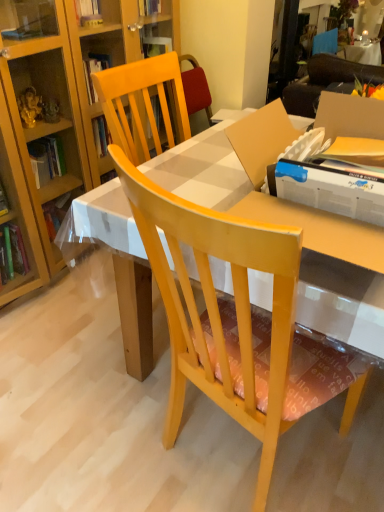
Find the location of a particular element. This screenshot has height=512, width=384. brown fabric couch at upper right is located at coordinates click(x=326, y=81).

The height and width of the screenshot is (512, 384). What are the coordinates of `light wood chair at center` in the screenshot? It's located at (221, 310).

Which of these two, brown fabric couch at upper right or light wood chair at center, is thinner?

With smaller width is brown fabric couch at upper right.

Measure the distance between brown fabric couch at upper right and light wood chair at center.

brown fabric couch at upper right and light wood chair at center are 5.60 feet apart from each other.

I want to click on chair on the left of brown fabric couch at upper right, so click(x=221, y=310).

Which object is positioned more to the left, green leafy plant at upper right or light wood chair at center?

From the viewer's perspective, light wood chair at center appears more on the left side.

Which point is more distant from viewer, (345, 6) or (179, 377)?

Positioned behind is point (345, 6).

From the picture: Considering the sizes of objects green leafy plant at upper right and light wood chair at center in the image provided, who is smaller, green leafy plant at upper right or light wood chair at center?

With smaller size is green leafy plant at upper right.

From the picture: Considering the relative sizes of green leafy plant at upper right and light wood chair at center in the image provided, is green leafy plant at upper right thinner than light wood chair at center?

Yes, green leafy plant at upper right is thinner than light wood chair at center.

From a real-world perspective, is brown fabric couch at upper right positioned under green leafy plant at upper right based on gravity?

Actually, brown fabric couch at upper right is physically above green leafy plant at upper right in the real world.

Between brown fabric couch at upper right and green leafy plant at upper right, which one has larger width?

Wider between the two is green leafy plant at upper right.

Between point (321, 79) and point (342, 38), which one is positioned behind?

The point (342, 38) is farther from the camera.

Is brown fabric couch at upper right oriented towards green leafy plant at upper right?

Yes, brown fabric couch at upper right is oriented towards green leafy plant at upper right.

Based on the photo, could you tell me if green leafy plant at upper right is facing brown fabric couch at upper right?

No, green leafy plant at upper right does not turn towards brown fabric couch at upper right.

Which object is further away from the camera taking this photo, green leafy plant at upper right or brown fabric couch at upper right?

green leafy plant at upper right is further from the camera.

Does green leafy plant at upper right have a smaller size compared to brown fabric couch at upper right?

Actually, green leafy plant at upper right might be larger than brown fabric couch at upper right.

From the image's perspective, between green leafy plant at upper right and brown fabric couch at upper right, which one is located above?

green leafy plant at upper right, from the image's perspective.

Looking at this image, considering the sizes of objects light wood chair at center and green leafy plant at upper right in the image provided, who is wider, light wood chair at center or green leafy plant at upper right?

light wood chair at center.

Which is in front, light wood chair at center or green leafy plant at upper right?

light wood chair at center is closer to the camera.

Consider the image. Is green leafy plant at upper right at the back of light wood chair at center?

Yes, light wood chair at center is facing away from green leafy plant at upper right.

Considering the positions of points (289, 360) and (329, 15), is point (289, 360) closer to camera compared to point (329, 15)?

Yes, point (289, 360) is in front of point (329, 15).

How far apart are light wood chair at center and brown fabric couch at upper right?

They are 5.60 feet apart.

Which object is further away from the camera, light wood chair at center or brown fabric couch at upper right?

brown fabric couch at upper right is further away from the camera.

Based on the photo, who is bigger, light wood chair at center or brown fabric couch at upper right?

With larger size is light wood chair at center.

Locate an element on the screen. This screenshot has height=512, width=384. studio couch located above the light wood chair at center (from the image's perspective) is located at coordinates (326, 81).

The image size is (384, 512). In order to click on chair in front of the green leafy plant at upper right in this screenshot , I will do `click(221, 310)`.

Considering their positions, is light wood chair at center positioned further to brown fabric couch at upper right than green leafy plant at upper right?

light wood chair at center.

From the image, which object appears to be nearer to green leafy plant at upper right, light wood chair at center or brown fabric couch at upper right?

brown fabric couch at upper right is positioned closer to the anchor green leafy plant at upper right.

From the image, which object appears to be farther from light wood chair at center, brown fabric couch at upper right or green leafy plant at upper right?

green leafy plant at upper right is positioned further to the anchor light wood chair at center.

When comparing their distances from brown fabric couch at upper right, does green leafy plant at upper right or light wood chair at center seem further?

light wood chair at center lies further to brown fabric couch at upper right than the other object.

From the image, which object appears to be nearer to light wood chair at center, green leafy plant at upper right or brown fabric couch at upper right?

Among the two, brown fabric couch at upper right is located nearer to light wood chair at center.

Based on their spatial positions, is brown fabric couch at upper right or light wood chair at center further from green leafy plant at upper right?

light wood chair at center is positioned further to the anchor green leafy plant at upper right.

Locate an element on the screen. studio couch between light wood chair at center and green leafy plant at upper right along the z-axis is located at coordinates (326, 81).